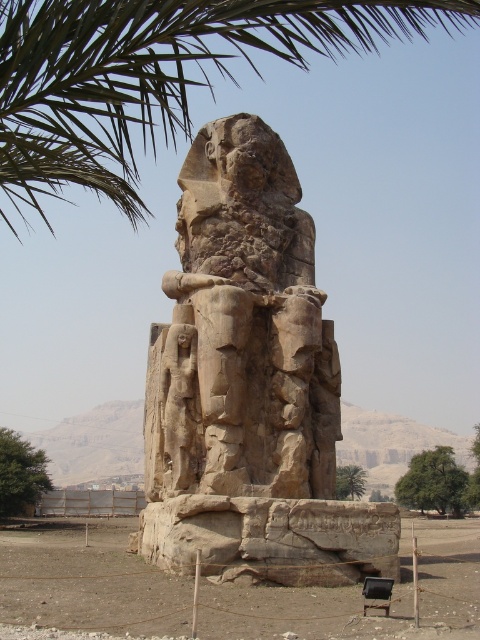
Between rough stone statue at center and green leafy tree at lower right, which one appears on the right side from the viewer's perspective?

green leafy tree at lower right is more to the right.

How much distance is there between rough stone statue at center and green leafy tree at lower right?

rough stone statue at center and green leafy tree at lower right are 245.21 feet apart.

The width and height of the screenshot is (480, 640). What are the coordinates of `rough stone statue at center` in the screenshot? It's located at tap(241, 332).

Is green leafy palm tree at upper left positioned before green leafy tree at lower left?

Yes, green leafy palm tree at upper left is closer to the viewer.

Is green leafy palm tree at upper left thinner than green leafy tree at lower left?

No.

Describe the element at coordinates (154, 76) in the screenshot. I see `green leafy palm tree at upper left` at that location.

Where is `green leafy palm tree at upper left`? green leafy palm tree at upper left is located at coordinates (154, 76).

Does point (14, 513) come in front of point (356, 492)?

Yes, it is.

Does green leafy tree at lower left appear on the right side of green leafy tree at lower center?

In fact, green leafy tree at lower left is to the left of green leafy tree at lower center.

Identify the location of green leafy tree at lower left. The width and height of the screenshot is (480, 640). (20, 474).